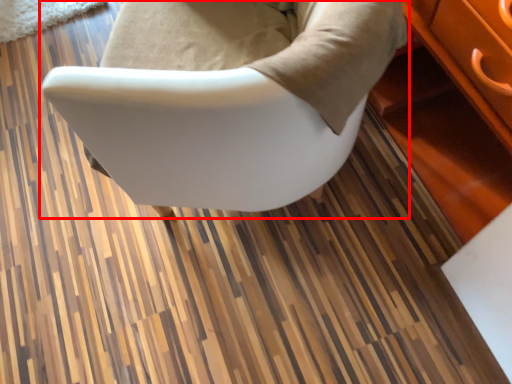
Question: In this image, where is chair (annotated by the red box) located relative to table?

Choices:
 (A) left
 (B) right

Answer: (A)